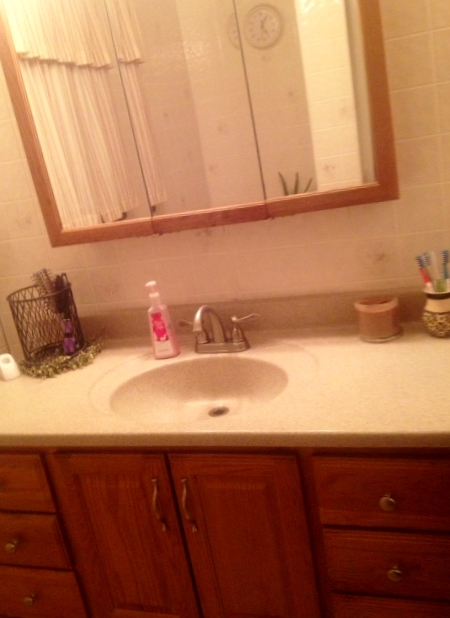
I want to click on wooden bathroom cabinet drawers, so click(19, 494), click(27, 543), click(41, 603), click(357, 497), click(355, 551), click(358, 607).